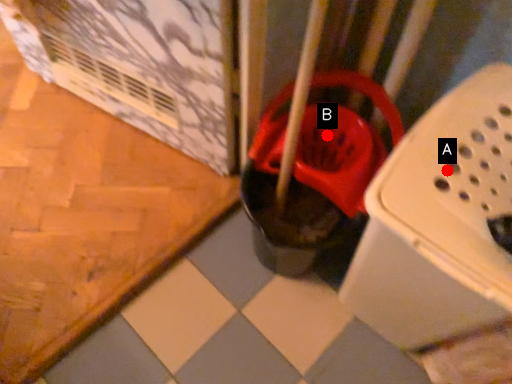
Question: Two points are circled on the image, labeled by A and B beside each circle. Which point appears closest to the camera in this image?

Choices:
 (A) A is closer
 (B) B is closer

Answer: (A)